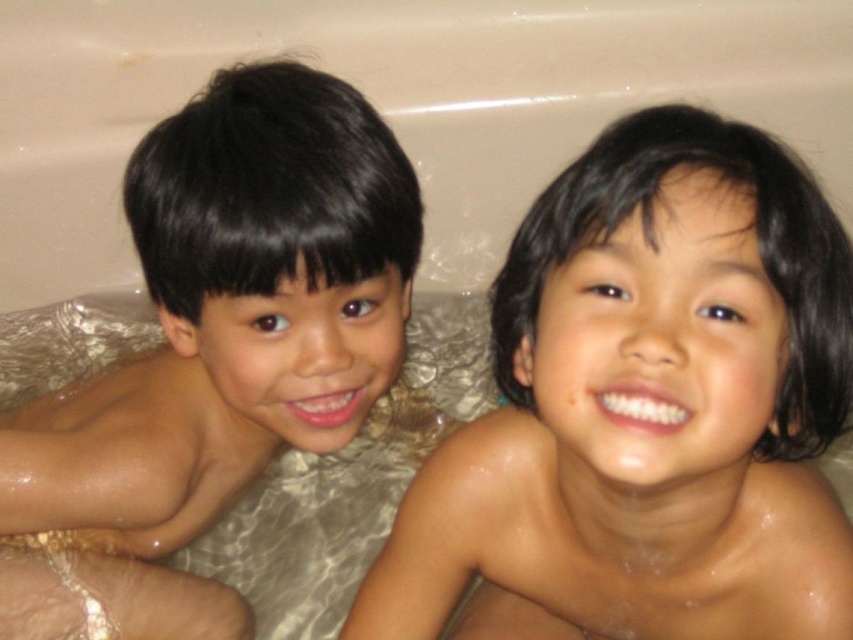
Question: Can you confirm if dry skin child at center is smaller than brown matte skin at left?

Choices:
 (A) no
 (B) yes

Answer: (B)

Question: Does dry skin child at center lie behind brown matte skin at left?

Choices:
 (A) yes
 (B) no

Answer: (B)

Question: Is dry skin child at center to the right of brown matte skin at left from the viewer's perspective?

Choices:
 (A) yes
 (B) no

Answer: (A)

Question: Which object appears closest to the camera in this image?

Choices:
 (A) brown matte skin at left
 (B) dry skin child at center

Answer: (B)

Question: Which of the following is the farthest from the observer?

Choices:
 (A) brown matte skin at left
 (B) dry skin child at center

Answer: (A)